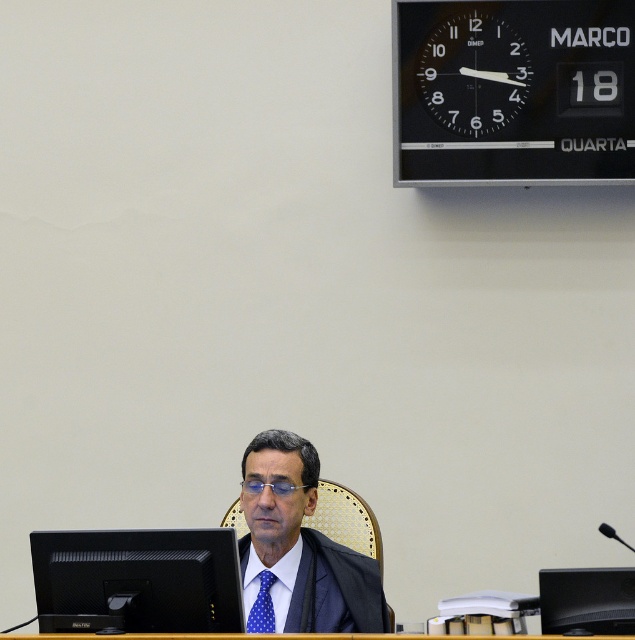
Question: Which point is farther to the camera?

Choices:
 (A) (258, 618)
 (B) (603, 577)
 (C) (323, 620)

Answer: (A)

Question: Can you confirm if dark gray suit at center is thinner than blue dotted fabric tie at center?

Choices:
 (A) no
 (B) yes

Answer: (A)

Question: In this image, where is dark gray suit at center located relative to black plastic monitor at center?

Choices:
 (A) left
 (B) right

Answer: (A)

Question: Based on their relative distances, which object is farther from the blue dotted fabric tie at center?

Choices:
 (A) black plastic monitor at center
 (B) black plastic clock at upper center
 (C) black matte monitor at lower left
 (D) black plastic table at lower center

Answer: (B)

Question: Among these objects, which one is farthest from the camera?

Choices:
 (A) black matte monitor at lower left
 (B) black plastic clock at upper center

Answer: (B)

Question: Is black matte monitor at lower left wider than dark gray suit at center?

Choices:
 (A) yes
 (B) no

Answer: (A)